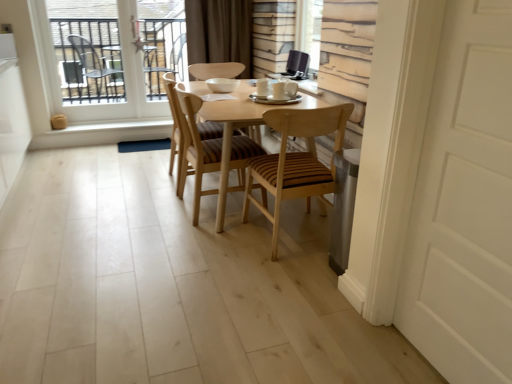
The image size is (512, 384). Identify the location of free space to the left of wooden at center, which is the 1th chair from left to right. (139, 184).